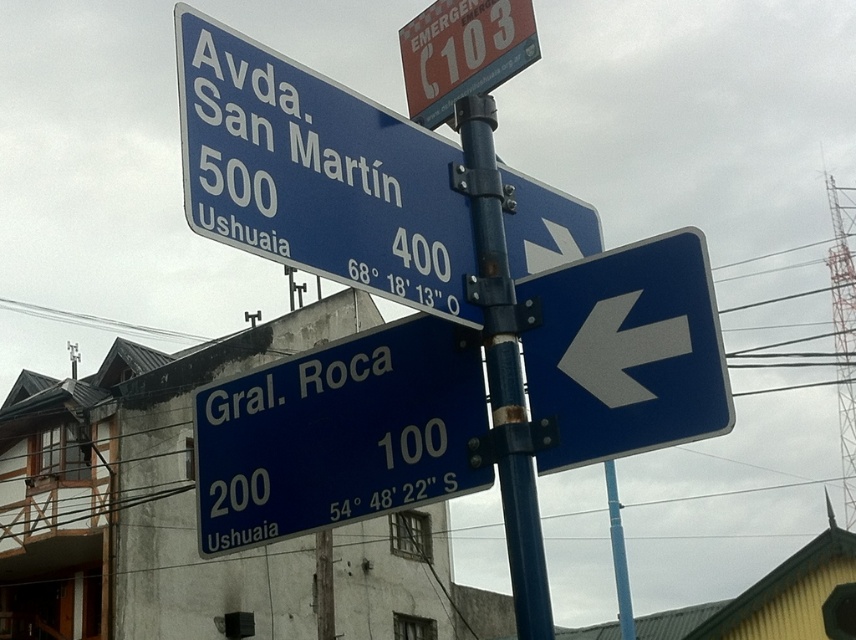
Does metallic blue pole at center appear on the left side of metallic emergency sign at upper center?

Incorrect, metallic blue pole at center is not on the left side of metallic emergency sign at upper center.

Who is taller, metallic blue pole at center or metallic emergency sign at upper center?

metallic blue pole at center is taller.

Between point (477, 122) and point (467, 35), which one is positioned behind?

Positioned behind is point (467, 35).

At what (x,y) coordinates should I click in order to perform the action: click on metallic blue pole at center. Please return your answer as a coordinate pair (x, y). The width and height of the screenshot is (856, 640). Looking at the image, I should click on (503, 369).

Is blue metallic street sign at upper center above metallic emergency sign at upper center?

Actually, blue metallic street sign at upper center is below metallic emergency sign at upper center.

Between point (188, 64) and point (414, 24), which one is positioned in front?

Positioned in front is point (188, 64).

I want to click on blue metallic street sign at upper center, so click(317, 173).

Does blue metallic street sign at upper center have a greater height compared to blue metallic sign at lower left?

Indeed, blue metallic street sign at upper center has a greater height compared to blue metallic sign at lower left.

Is blue metallic street sign at upper center to the left of blue metallic sign at lower left from the viewer's perspective?

No, blue metallic street sign at upper center is not to the left of blue metallic sign at lower left.

Is point (462, 240) farther from camera compared to point (232, 483)?

That is False.

Locate an element on the screen. blue metallic street sign at upper center is located at coordinates (317, 173).